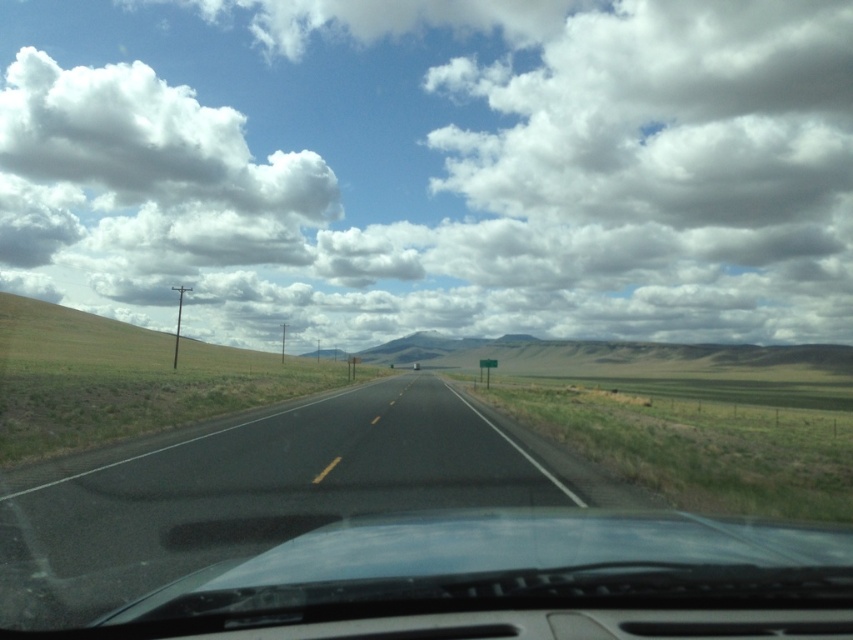
Question: Can you confirm if black asphalt highway at center is positioned to the right of transparent glass windshield at center?

Choices:
 (A) yes
 (B) no

Answer: (B)

Question: Among these objects, which one is nearest to the camera?

Choices:
 (A) transparent glass windshield at center
 (B) black asphalt highway at center
 (C) white fluffy cloud at upper center

Answer: (B)

Question: In this image, where is white fluffy cloud at upper center located relative to transparent glass windshield at center?

Choices:
 (A) above
 (B) below

Answer: (A)

Question: Is black asphalt highway at center thinner than transparent glass windshield at center?

Choices:
 (A) yes
 (B) no

Answer: (B)

Question: Which object is closer to the camera taking this photo?

Choices:
 (A) black asphalt highway at center
 (B) white fluffy cloud at upper center

Answer: (A)

Question: Which object appears farthest from the camera in this image?

Choices:
 (A) transparent glass windshield at center
 (B) black asphalt highway at center
 (C) white fluffy cloud at upper center

Answer: (C)